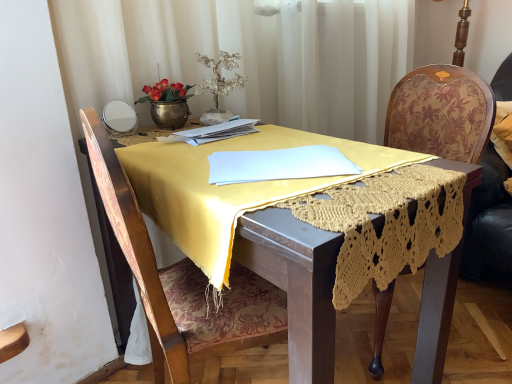
Question: Can we say wooden chair at center, which ranks as the 2th chair in right-to-left order, lies outside wooden floral-patterned chair at right, marked as the 1th chair in a right-to-left arrangement?

Choices:
 (A) yes
 (B) no

Answer: (A)

Question: Is wooden chair at center, which ranks as the 2th chair in right-to-left order, looking in the opposite direction of wooden floral-patterned chair at right, marked as the 1th chair in a right-to-left arrangement?

Choices:
 (A) yes
 (B) no

Answer: (B)

Question: Is wooden chair at center, which is counted as the first chair, starting from the left, closer to the viewer compared to wooden floral-patterned chair at right, marked as the 1th chair in a right-to-left arrangement?

Choices:
 (A) no
 (B) yes

Answer: (B)

Question: Are wooden chair at center, which is counted as the first chair, starting from the left, and wooden floral-patterned chair at right, marked as the 1th chair in a right-to-left arrangement, beside each other?

Choices:
 (A) yes
 (B) no

Answer: (B)

Question: Does wooden chair at center, which ranks as the 2th chair in right-to-left order, have a greater width compared to wooden floral-patterned chair at right, marked as the 1th chair in a right-to-left arrangement?

Choices:
 (A) yes
 (B) no

Answer: (A)

Question: Could you tell me if wooden chair at center, which is counted as the first chair, starting from the left, is facing wooden floral-patterned chair at right, placed as the second chair when sorted from left to right?

Choices:
 (A) no
 (B) yes

Answer: (B)

Question: Is wooden chair at center, which ranks as the 2th chair in right-to-left order, not inside velvet floral swivel chair at right?

Choices:
 (A) yes
 (B) no

Answer: (A)

Question: From a real-world perspective, is wooden chair at center, which is counted as the first chair, starting from the left, located beneath velvet floral swivel chair at right?

Choices:
 (A) yes
 (B) no

Answer: (A)

Question: Considering the relative positions of wooden chair at center, which is counted as the first chair, starting from the left, and velvet floral swivel chair at right in the image provided, is wooden chair at center, which is counted as the first chair, starting from the left, to the left of velvet floral swivel chair at right from the viewer's perspective?

Choices:
 (A) yes
 (B) no

Answer: (A)

Question: Can you confirm if wooden chair at center, which is counted as the first chair, starting from the left, is shorter than velvet floral swivel chair at right?

Choices:
 (A) no
 (B) yes

Answer: (A)

Question: Considering the relative sizes of wooden chair at center, which is counted as the first chair, starting from the left, and velvet floral swivel chair at right in the image provided, is wooden chair at center, which is counted as the first chair, starting from the left, thinner than velvet floral swivel chair at right?

Choices:
 (A) no
 (B) yes

Answer: (A)

Question: Does wooden chair at center, which is counted as the first chair, starting from the left, contain velvet floral swivel chair at right?

Choices:
 (A) yes
 (B) no

Answer: (B)

Question: Does velvet floral swivel chair at right have a greater height compared to wooden floral-patterned chair at right, placed as the second chair when sorted from left to right?

Choices:
 (A) no
 (B) yes

Answer: (A)